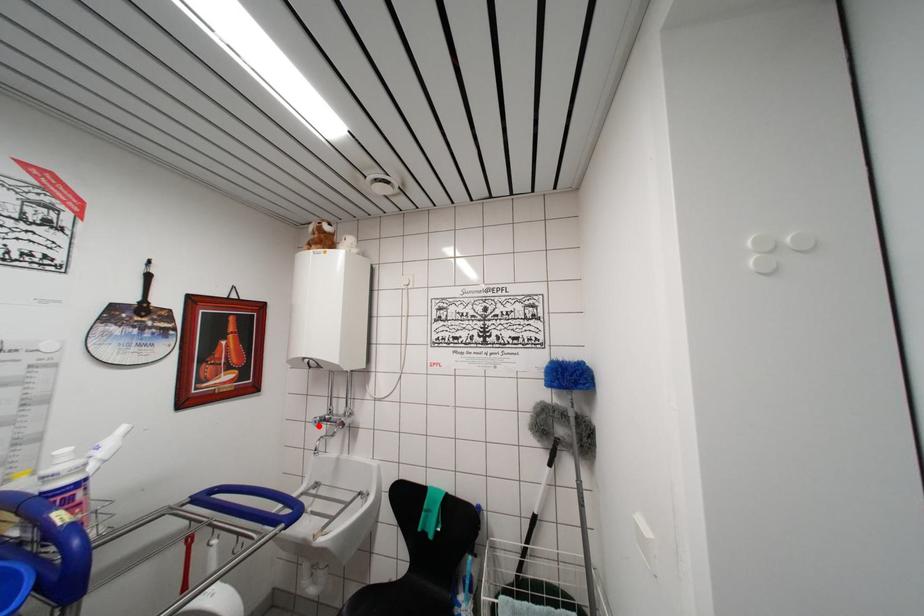
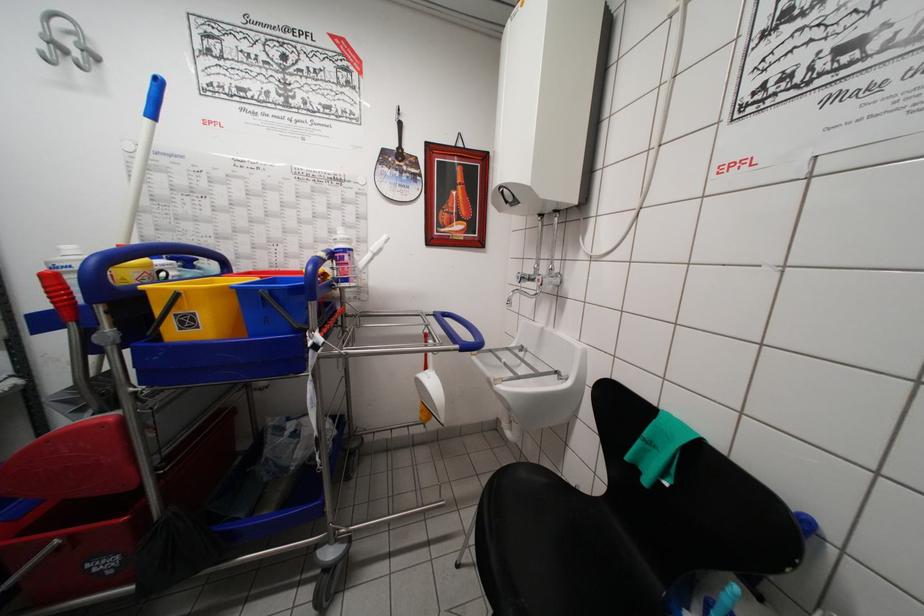
Find the pixel in the second image that matches the highlighted location in the first image.

(521, 282)